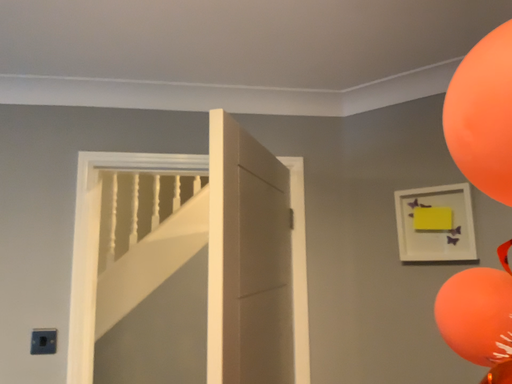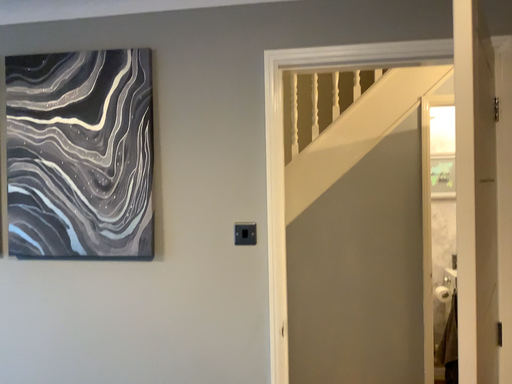
Question: Which way did the camera rotate in the video?

Choices:
 (A) rotated upward
 (B) rotated downward

Answer: (B)